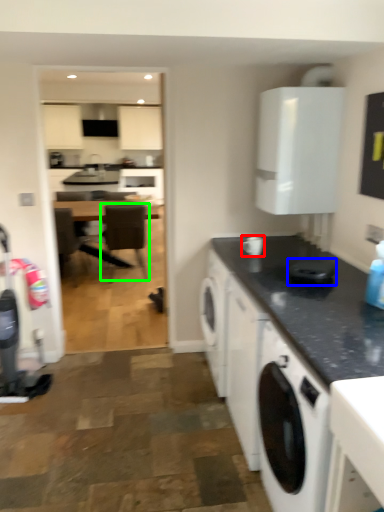
Question: Based on their relative distances, which object is farther from appliance (highlighted by a red box)? Choose from appliance (highlighted by a blue box) and chair (highlighted by a green box).

Choices:
 (A) appliance
 (B) chair

Answer: (B)